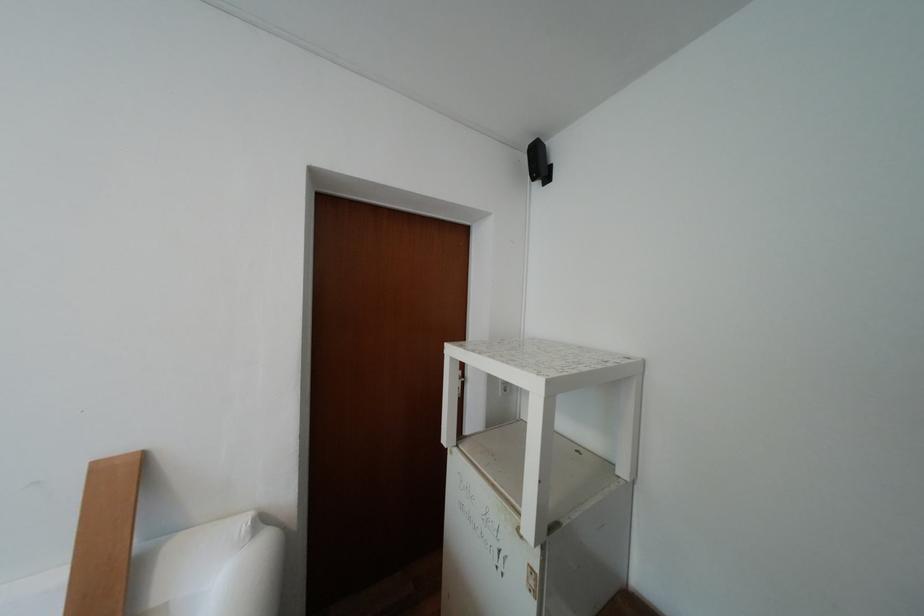
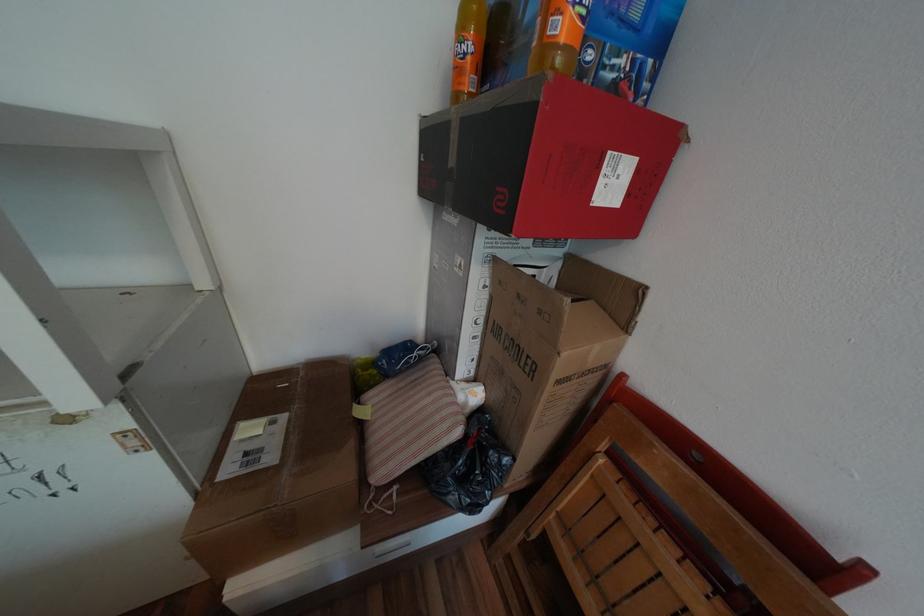
Based on the continuous images, in which direction is the camera rotating?

The rotation direction of the camera is right-down.